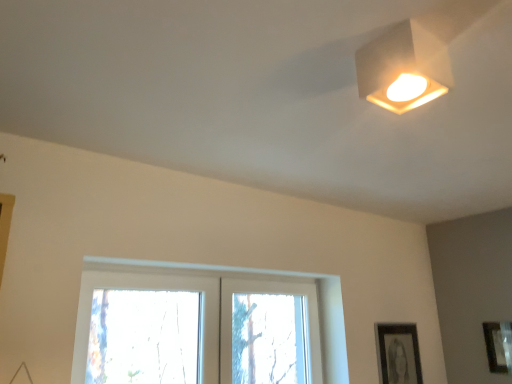
The height and width of the screenshot is (384, 512). Identify the location of matte black picture frame at lower right, the 2th picture frame in the left-to-right sequence. (499, 346).

At what (x,y) coordinates should I click in order to perform the action: click on black matte picture frame at lower right, the first picture frame in the left-to-right sequence. Please return your answer as a coordinate pair (x, y). The image size is (512, 384). Looking at the image, I should click on tap(398, 353).

Is white matte square lamp at upper right wider or thinner than clear glass window at center?

white matte square lamp at upper right is thinner than clear glass window at center.

From a real-world perspective, is white matte square lamp at upper right on clear glass window at center?

Correct, in the physical world, white matte square lamp at upper right is higher than clear glass window at center.

Looking at the image, does white matte square lamp at upper right seem bigger or smaller compared to clear glass window at center?

Considering their sizes, white matte square lamp at upper right takes up less space than clear glass window at center.

Does white matte square lamp at upper right lie in front of clear glass window at center?

Yes, white matte square lamp at upper right is closer to the viewer.

Which point is more distant from viewer, (322,348) or (386,88)?

The point (322,348) is farther.

Is the surface of clear glass window at center in direct contact with white matte square lamp at upper right?

There is a gap between clear glass window at center and white matte square lamp at upper right.

How much distance is there between clear glass window at center and white matte square lamp at upper right?

A distance of 4.27 feet exists between clear glass window at center and white matte square lamp at upper right.

Consider the image. Between clear glass window at center and white matte square lamp at upper right, which one is positioned behind?

clear glass window at center is further away from the camera.

Is black matte picture frame at lower right, the first picture frame in the left-to-right sequence, looking in the opposite direction of matte black picture frame at lower right, the first picture frame from the right?

black matte picture frame at lower right, the first picture frame in the left-to-right sequence, is not turned away from matte black picture frame at lower right, the first picture frame from the right.

Considering the points (401, 326) and (500, 323), which point is in front, point (401, 326) or point (500, 323)?

The point (500, 323) is closer.

Is black matte picture frame at lower right, the first picture frame in the left-to-right sequence, at the right side of matte black picture frame at lower right, the 2th picture frame in the left-to-right sequence?

No, black matte picture frame at lower right, the first picture frame in the left-to-right sequence, is not to the right of matte black picture frame at lower right, the 2th picture frame in the left-to-right sequence.

From the image's perspective, is black matte picture frame at lower right, the first picture frame in the left-to-right sequence, under matte black picture frame at lower right, the first picture frame from the right?

Yes.

Looking at this image, is matte black picture frame at lower right, the first picture frame from the right, closer to camera compared to white matte square lamp at upper right?

No, matte black picture frame at lower right, the first picture frame from the right, is behind white matte square lamp at upper right.

Could you tell me if matte black picture frame at lower right, the first picture frame from the right, is facing white matte square lamp at upper right?

Yes, matte black picture frame at lower right, the first picture frame from the right, is oriented towards white matte square lamp at upper right.

From the picture: Is matte black picture frame at lower right, the first picture frame from the right, not close to white matte square lamp at upper right?

matte black picture frame at lower right, the first picture frame from the right, is positioned a significant distance from white matte square lamp at upper right.

From a real-world perspective, relative to matte black picture frame at lower right, the first picture frame from the right, is clear glass window at center vertically above or below?

clear glass window at center is situated higher than matte black picture frame at lower right, the first picture frame from the right, in the real world.

How distant is clear glass window at center from matte black picture frame at lower right, the first picture frame from the right?

4.68 feet.

From the picture: Looking at their sizes, would you say clear glass window at center is wider or thinner than matte black picture frame at lower right, the first picture frame from the right?

In the image, clear glass window at center appears to be wider than matte black picture frame at lower right, the first picture frame from the right.

What's the angular difference between clear glass window at center and matte black picture frame at lower right, the first picture frame from the right,'s facing directions?

The angular difference between clear glass window at center and matte black picture frame at lower right, the first picture frame from the right, is 90.1 degrees.

Is white matte square lamp at upper right oriented towards black matte picture frame at lower right, which is the 2th picture frame in right-to-left order?

No.

Does white matte square lamp at upper right have a lesser height compared to black matte picture frame at lower right, the first picture frame in the left-to-right sequence?

Indeed, white matte square lamp at upper right has a lesser height compared to black matte picture frame at lower right, the first picture frame in the left-to-right sequence.

Considering the positions of objects white matte square lamp at upper right and black matte picture frame at lower right, the first picture frame in the left-to-right sequence, in the image provided, who is behind, white matte square lamp at upper right or black matte picture frame at lower right, the first picture frame in the left-to-right sequence,?

black matte picture frame at lower right, the first picture frame in the left-to-right sequence, is more distant.

Is point (413, 341) positioned before point (103, 263)?

That is False.

From a real-world perspective, is black matte picture frame at lower right, which is the 2th picture frame in right-to-left order, physically below clear glass window at center?

Yes, from a real-world perspective, black matte picture frame at lower right, which is the 2th picture frame in right-to-left order, is under clear glass window at center.

Do you think black matte picture frame at lower right, which is the 2th picture frame in right-to-left order, is within clear glass window at center, or outside of it?

black matte picture frame at lower right, which is the 2th picture frame in right-to-left order, is spatially situated outside clear glass window at center.

Does black matte picture frame at lower right, which is the 2th picture frame in right-to-left order, turn towards clear glass window at center?

No, black matte picture frame at lower right, which is the 2th picture frame in right-to-left order, is not aimed at clear glass window at center.

The image size is (512, 384). In the image, there is a clear glass window at center. Identify the location of lamp above it (from the image's perspective). (404, 68).

Locate an element on the screen. The height and width of the screenshot is (384, 512). window that is below the white matte square lamp at upper right (from the image's perspective) is located at coordinates (212, 305).

Looking at the image, which one is located closer to white matte square lamp at upper right, clear glass window at center or black matte picture frame at lower right, which is the 2th picture frame in right-to-left order?

Among the two, clear glass window at center is located nearer to white matte square lamp at upper right.

Based on their spatial positions, is clear glass window at center or white matte square lamp at upper right further from matte black picture frame at lower right, the first picture frame from the right?

white matte square lamp at upper right.

When comparing their distances from clear glass window at center, does white matte square lamp at upper right or black matte picture frame at lower right, the first picture frame in the left-to-right sequence, seem closer?

black matte picture frame at lower right, the first picture frame in the left-to-right sequence.

Estimate the real-world distances between objects in this image. Which object is further from clear glass window at center, black matte picture frame at lower right, which is the 2th picture frame in right-to-left order, or matte black picture frame at lower right, the first picture frame from the right?

matte black picture frame at lower right, the first picture frame from the right, is further to clear glass window at center.

Looking at the image, which one is located further to clear glass window at center, matte black picture frame at lower right, the first picture frame from the right, or black matte picture frame at lower right, which is the 2th picture frame in right-to-left order?

The object further to clear glass window at center is matte black picture frame at lower right, the first picture frame from the right.

From the image, which object appears to be farther from matte black picture frame at lower right, the first picture frame from the right, white matte square lamp at upper right or black matte picture frame at lower right, which is the 2th picture frame in right-to-left order?

white matte square lamp at upper right is positioned further to the anchor matte black picture frame at lower right, the first picture frame from the right.

Based on their spatial positions, is white matte square lamp at upper right or matte black picture frame at lower right, the first picture frame from the right, closer to black matte picture frame at lower right, the first picture frame in the left-to-right sequence?

Among the two, matte black picture frame at lower right, the first picture frame from the right, is located nearer to black matte picture frame at lower right, the first picture frame in the left-to-right sequence.

Considering their positions, is black matte picture frame at lower right, the first picture frame in the left-to-right sequence, positioned closer to matte black picture frame at lower right, the first picture frame from the right, than white matte square lamp at upper right?

black matte picture frame at lower right, the first picture frame in the left-to-right sequence, lies closer to matte black picture frame at lower right, the first picture frame from the right, than the other object.

Identify the location of picture frame located between clear glass window at center and matte black picture frame at lower right, the first picture frame from the right, in the left-right direction. (398, 353).

You are a GUI agent. You are given a task and a screenshot of the screen. Output one action in this format:
    pyautogui.click(x=<x>, y=<y>)
    Task: Click on the picture frame between white matte square lamp at upper right and black matte picture frame at lower right, the first picture frame in the left-to-right sequence, from front to back
    Image resolution: width=512 pixels, height=384 pixels.
    Given the screenshot: What is the action you would take?
    pyautogui.click(x=499, y=346)

Locate an element on the screen. This screenshot has height=384, width=512. window located between white matte square lamp at upper right and black matte picture frame at lower right, the first picture frame in the left-to-right sequence, in the depth direction is located at coordinates (212, 305).

Find the location of a particular element. lamp between clear glass window at center and matte black picture frame at lower right, the first picture frame from the right, from left to right is located at coordinates [x=404, y=68].